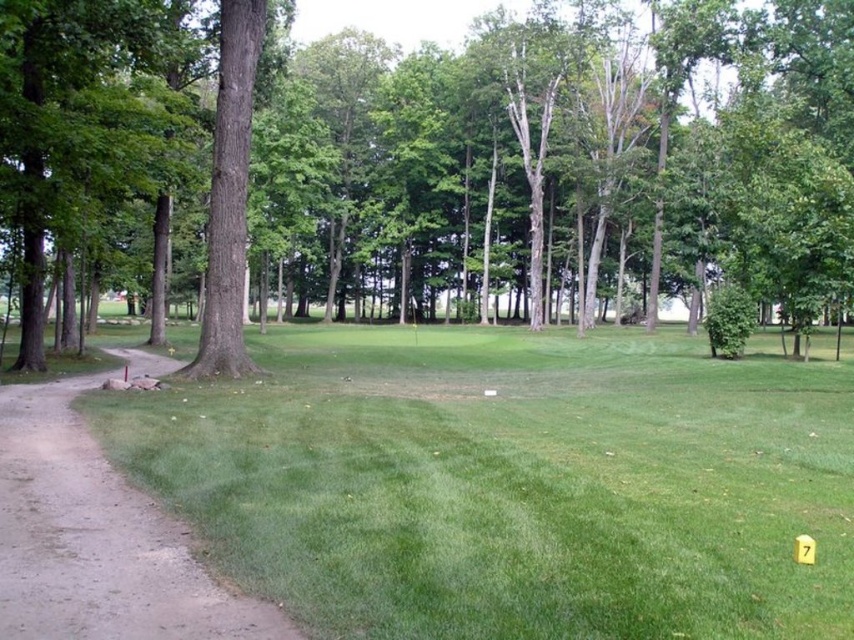
You are standing at the point marked by the coordinates point (430, 156) in the image. Based on the scene description, what can you see directly in front of you?

You can see a green leafy tree at center directly in front of you at the coordinates point (430, 156).

You are planning to set up a picnic blanket in the green grassy area at lower left. Considering the size of the green leafy tree at center, will there be enough space for the blanket without overlapping the tree?

The green leafy tree at center is wider than the green grassy area at lower left, so placing the picnic blanket there might not leave enough space as the tree occupies more width than the grassy area itself.